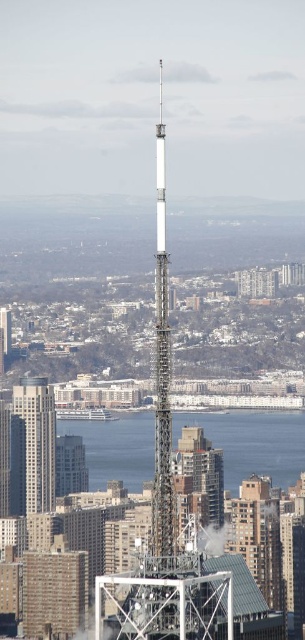
You are a city planner evaluating the view from the telecommunications tower. You notice the clear water at center and the matte glass skyscraper at center. Which of these two elements is wider from the tower observer perspective?

The clear water at center might be wider than the matte glass skyscraper at center according to the description.

You are a city planner reviewing the city layout. You notice the clear water at center and the matte glass skyscraper at center. Which object is positioned lower in the scene?

The clear water at center is located below the matte glass skyscraper at center, so it is positioned lower in the scene.

You are a city planner reviewing the image of the telecommunications tower and the surrounding area. Based on the location of the clear water at center, would you say the water is closer to the tower or further away from it?

The clear water at center is located at point coordinates that are further away from the tower, so it is positioned farther from the tower in the scene.